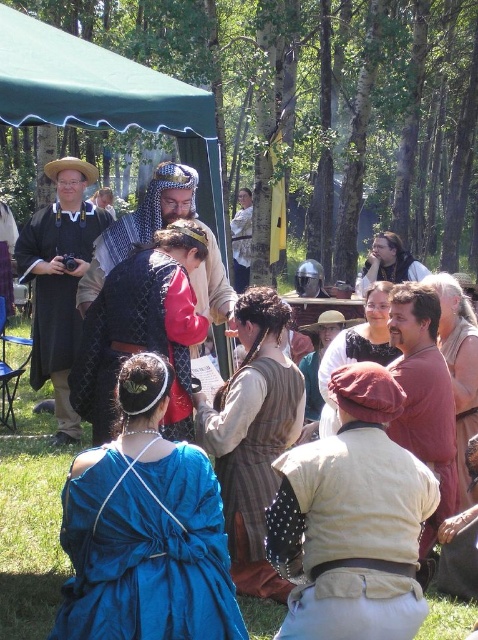
Is matte black robe at left above matte black tunic at center?

No.

This screenshot has height=640, width=478. What do you see at coordinates (60, 280) in the screenshot?
I see `matte black robe at left` at bounding box center [60, 280].

The height and width of the screenshot is (640, 478). Identify the location of matte black robe at left. (60, 280).

Which is behind, point (73, 268) or point (452, 371)?

Positioned behind is point (73, 268).

Image resolution: width=478 pixels, height=640 pixels. Find the location of `matte black robe at left`. matte black robe at left is located at coordinates (60, 280).

Between point (74, 273) and point (415, 358), which one is positioned in front?

Point (415, 358)

Looking at this image, is matte black robe at left to the right of matte brown tunic at center from the viewer's perspective?

No, matte black robe at left is not to the right of matte brown tunic at center.

Which is in front, point (96, 216) or point (417, 308)?

Point (417, 308) is in front.

Where is `matte black robe at left`? matte black robe at left is located at coordinates (60, 280).